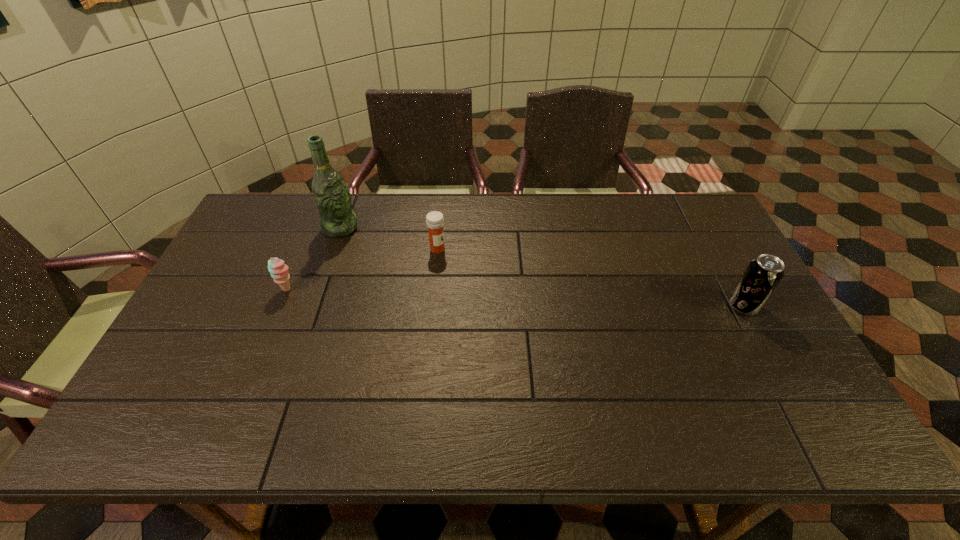
Identify the location of unoccupied position between the third nearest object and the sherbert. This screenshot has height=540, width=960. (363, 269).

Where is `unoccupied position between the second object from left to right and the soda can`? This screenshot has width=960, height=540. unoccupied position between the second object from left to right and the soda can is located at coordinates (541, 267).

Image resolution: width=960 pixels, height=540 pixels. I want to click on blank region between the second farthest object and the second tallest object, so click(590, 278).

I want to click on vacant area that lies between the third object from left to right and the beer bottle, so click(389, 239).

Where is `object that is the second closest to the rightmost object`? The image size is (960, 540). object that is the second closest to the rightmost object is located at coordinates (331, 195).

Select which object is the second closest to the sherbert. Please provide its 2D coordinates. Your answer should be formatted as a tuple, i.e. [(x, y)], where the tuple contains the x and y coordinates of a point satisfying the conditions above.

[(434, 220)]

Identify the location of free space that satisfies the following two spatial constraints: 1. on the front side of the farthest object; 2. on the left side of the third shortest object. (314, 306).

At what (x,y) coordinates should I click in order to perform the action: click on vacant space that satisfies the following two spatial constraints: 1. on the front side of the medicine; 2. on the right side of the second tallest object. Please return your answer as a coordinate pair (x, y). The image size is (960, 540). Looking at the image, I should click on (x=432, y=306).

Find the location of a particular element. This screenshot has height=540, width=960. free location that satisfies the following two spatial constraints: 1. on the front side of the medicine; 2. on the left side of the rightmost object is located at coordinates (432, 306).